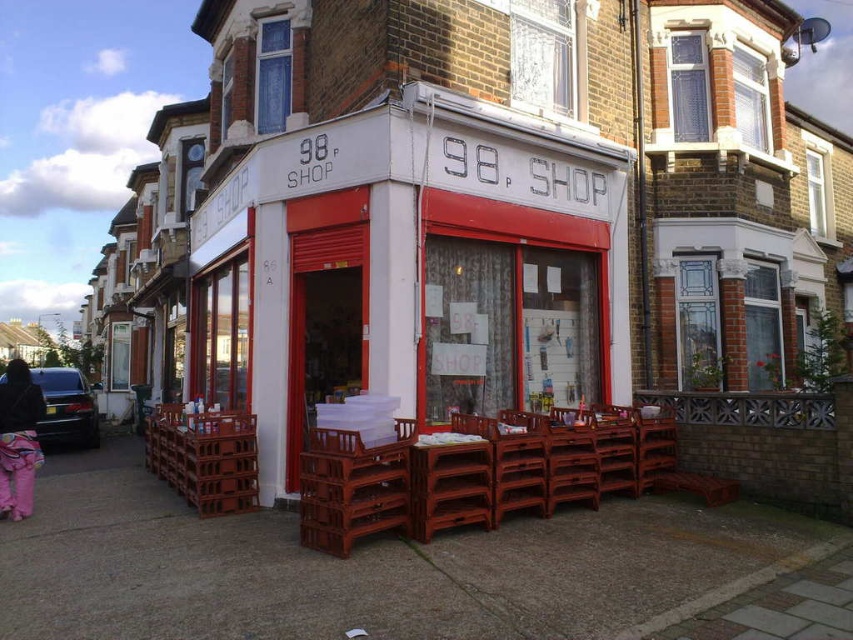
Question: Can you confirm if brown wooden crates at lower center is thinner than mahogany wood table at center?

Choices:
 (A) no
 (B) yes

Answer: (B)

Question: Which of the following is the closest to the observer?

Choices:
 (A) matte white sign at center
 (B) brown wooden crate at center
 (C) brown wooden chair at center

Answer: (B)

Question: From the image, what is the correct spatial relationship of matte white sign at center in relation to brown wooden chair at center?

Choices:
 (A) below
 (B) above

Answer: (B)

Question: Which object is the farthest from the brown wooden chair at center?

Choices:
 (A) matte white sign at center
 (B) brown wooden crates at lower center

Answer: (A)

Question: Based on their relative distances, which object is farther from the brown wooden chair at center?

Choices:
 (A) matte white sign at center
 (B) brown wooden crate at lower left

Answer: (B)

Question: Can you confirm if brown wooden crate at center is thinner than mahogany wood table at center?

Choices:
 (A) yes
 (B) no

Answer: (B)